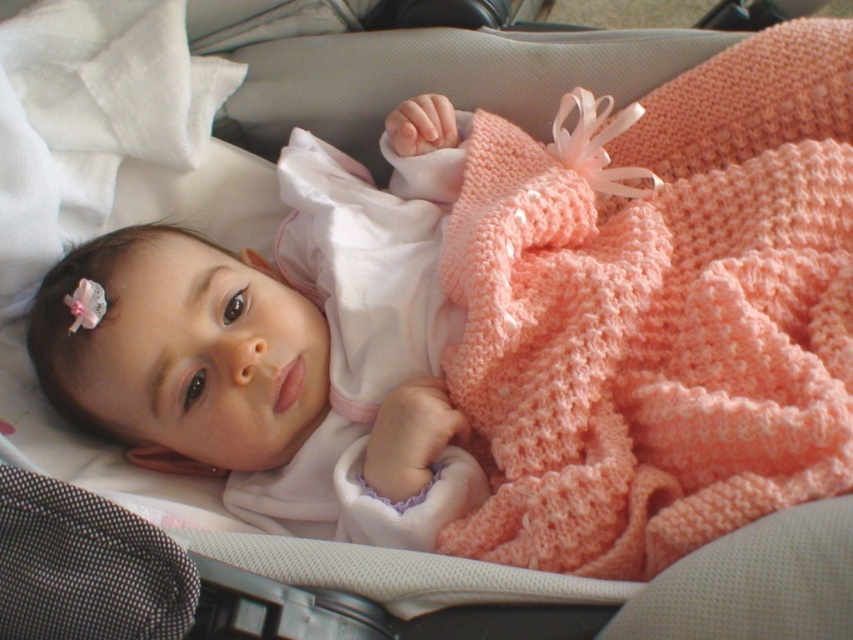
Identify the location of peach knitted blanket at center. (660, 316).

Where is `peach knitted blanket at center`? This screenshot has width=853, height=640. peach knitted blanket at center is located at coordinates (660, 316).

You are a GUI agent. You are given a task and a screenshot of the screen. Output one action in this format:
    pyautogui.click(x=<x>, y=<y>)
    Task: Click on the peach knitted blanket at center
    The image size is (853, 640).
    Given the screenshot: What is the action you would take?
    pyautogui.click(x=660, y=316)